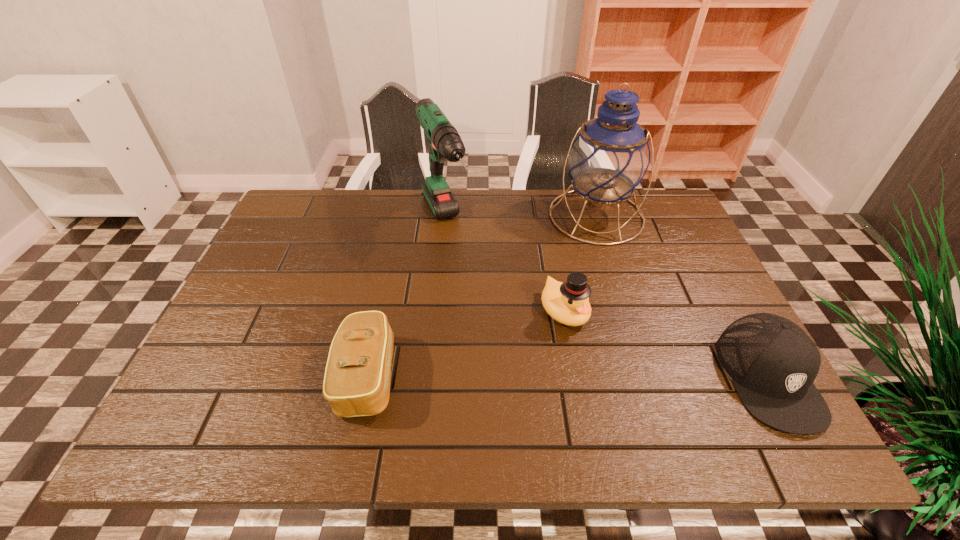
Identify the location of clutch bag. (357, 378).

The width and height of the screenshot is (960, 540). Identify the location of the rightmost object. (773, 363).

Identify the location of duck. The height and width of the screenshot is (540, 960). (567, 302).

Locate an element on the screen. the second tallest object is located at coordinates (444, 141).

Where is `lantern`? This screenshot has height=540, width=960. lantern is located at coordinates (610, 157).

Identify the location of free space located on the zipper side of the clutch bag. pos(587,376).

Locate an element on the screen. This screenshot has height=540, width=960. vacant space located 0.060m on the front-facing side of the duck is located at coordinates (595, 351).

Locate an element on the screen. The image size is (960, 540). vacant space located on the front-facing side of the duck is located at coordinates tap(604, 361).

Where is `blank space located 0.190m on the front-facing side of the duck`? blank space located 0.190m on the front-facing side of the duck is located at coordinates pos(635,399).

Locate an element on the screen. The height and width of the screenshot is (540, 960). vacant space situated on the handle side of the drill is located at coordinates (x=469, y=295).